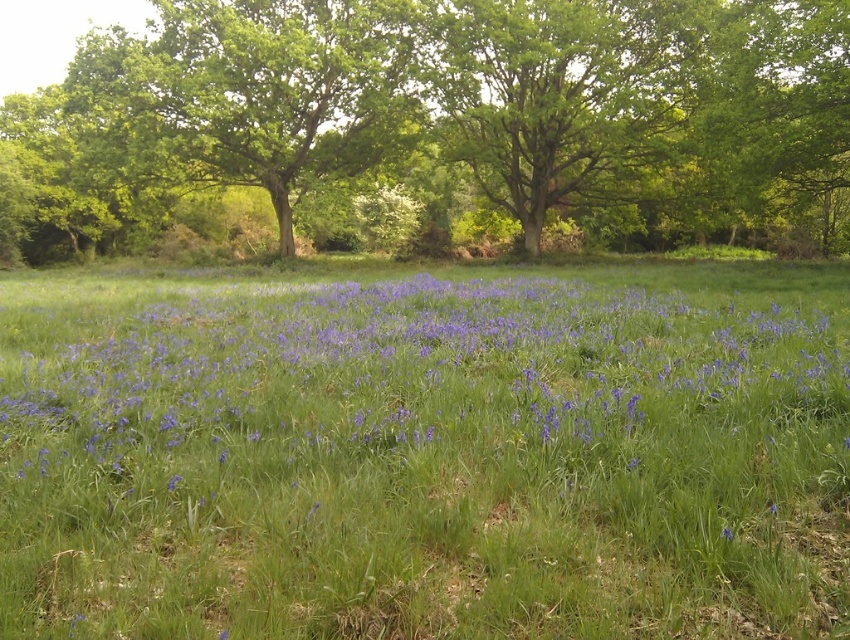
Question: Considering the relative positions of purple matte flowers at center and green leafy tree at center in the image provided, where is purple matte flowers at center located with respect to green leafy tree at center?

Choices:
 (A) above
 (B) below

Answer: (B)

Question: Is green leafy tree at center to the right of purple matte flower at lower right from the viewer's perspective?

Choices:
 (A) no
 (B) yes

Answer: (A)

Question: Is purple matte flowers at center positioned at the back of purple matte flower at lower right?

Choices:
 (A) yes
 (B) no

Answer: (B)

Question: Which point is closer to the camera taking this photo?

Choices:
 (A) (140, 369)
 (B) (327, 138)

Answer: (A)

Question: Estimate the real-world distances between objects in this image. Which object is closer to the green leafy tree at center?

Choices:
 (A) purple matte flower at lower right
 (B) purple matte flowers at center

Answer: (B)

Question: Which object is positioned closest to the green leafy tree at center?

Choices:
 (A) purple matte flower at lower right
 (B) purple matte flowers at center

Answer: (B)